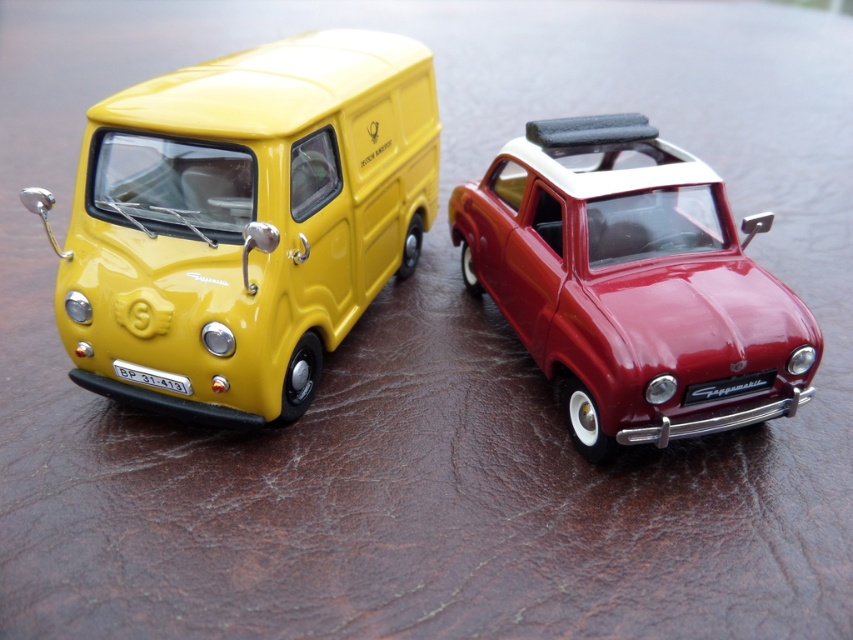
Who is more distant from viewer, (155, 180) or (747, 300)?

Point (155, 180)

Looking at this image, between yellow glossy van at left and shiny red car at center, which one appears on the left side from the viewer's perspective?

Positioned to the left is yellow glossy van at left.

Does point (354, 292) come behind point (769, 365)?

Yes, point (354, 292) is farther from viewer.

What are the coordinates of `yellow glossy van at left` in the screenshot? It's located at (242, 220).